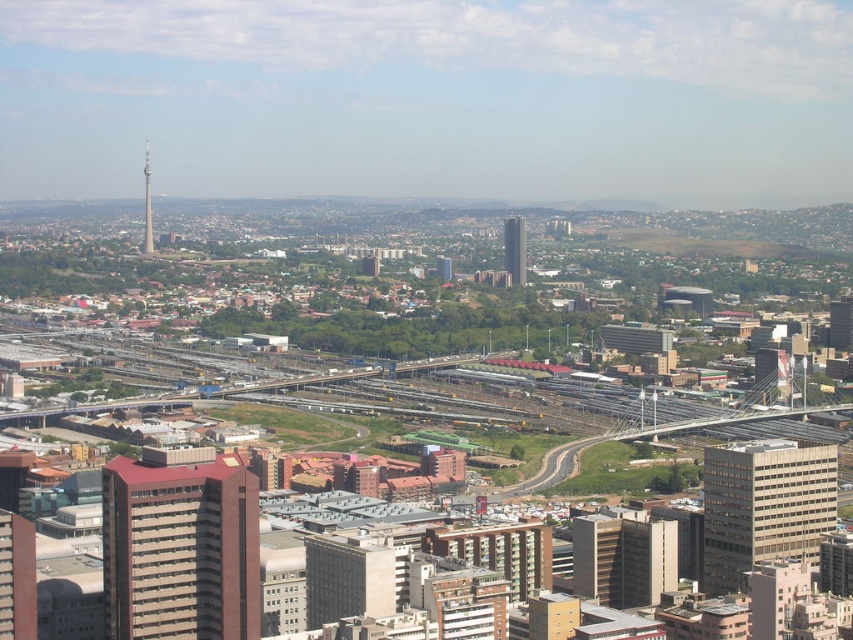
Question: Is smooth glass skyscraper at center below shiny metallic tower at upper left?

Choices:
 (A) no
 (B) yes

Answer: (B)

Question: Which point is farther to the camera?

Choices:
 (A) smooth glass skyscraper at center
 (B) red brick building at center

Answer: (B)

Question: Among these points, which one is farthest from the camera?

Choices:
 (A) [x=248, y=516]
 (B) [x=830, y=508]

Answer: (B)

Question: From the image, what is the correct spatial relationship of red brick building at center in relation to beige concrete building at center?

Choices:
 (A) left
 (B) right

Answer: (A)

Question: Does smooth glass skyscraper at center lie behind shiny metallic tower at upper left?

Choices:
 (A) yes
 (B) no

Answer: (B)

Question: Which object is the farthest from the shiny metallic tower at upper left?

Choices:
 (A) smooth glass skyscraper at center
 (B) beige concrete building at center
 (C) red brick building at center

Answer: (B)